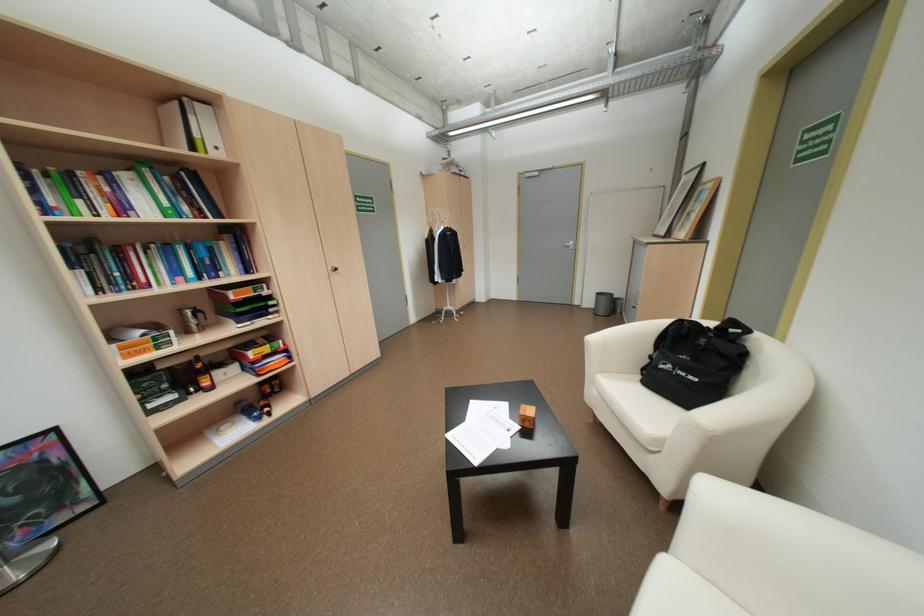
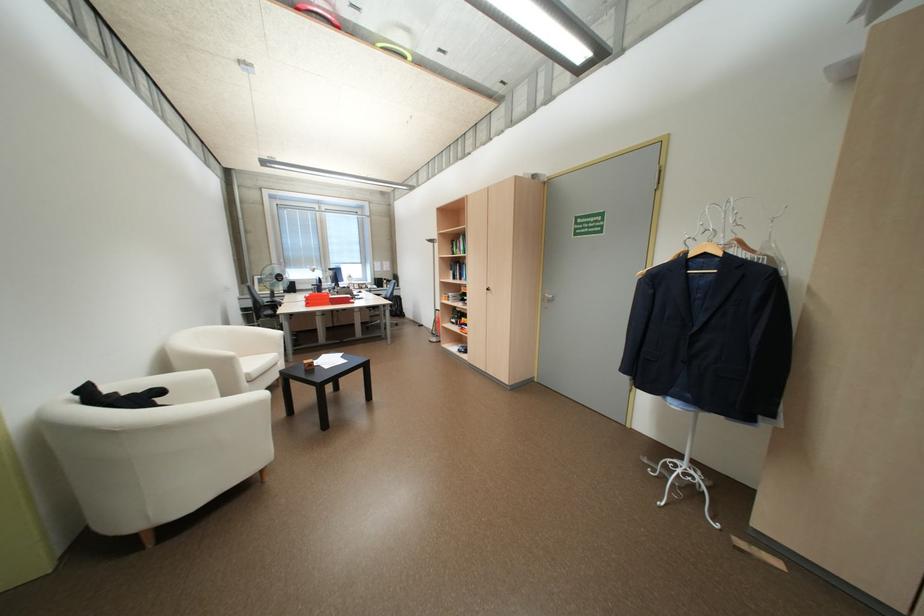
In the second image, find the point that corresponds to (x=103, y=299) in the first image.

(460, 280)